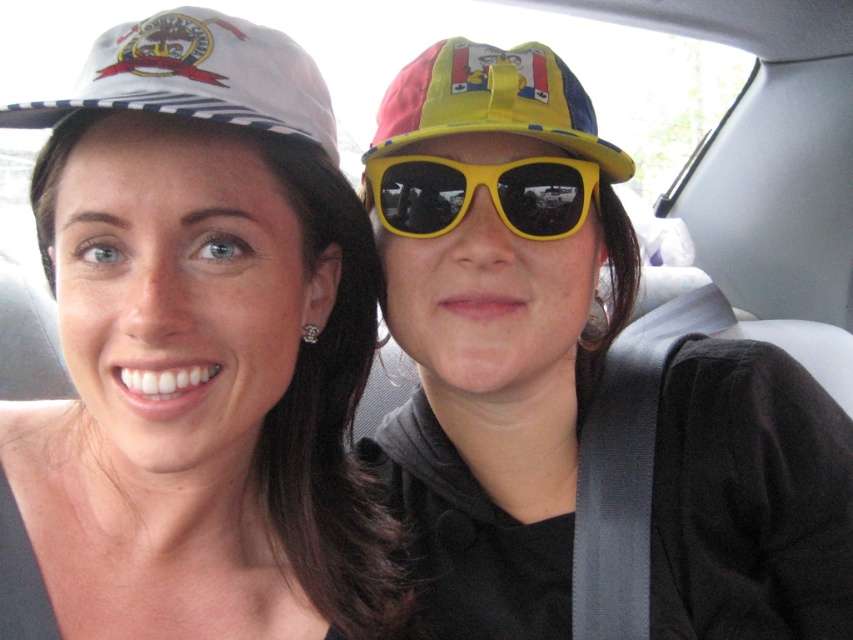
Consider the image. Is white glossy hat at upper left shorter than yellow matte sunglasses at upper center?

Yes, white glossy hat at upper left is shorter than yellow matte sunglasses at upper center.

Does point (316, 172) come closer to viewer compared to point (457, 525)?

Yes, point (316, 172) is closer to viewer.

Which is in front, point (165, 115) or point (564, 538)?

Point (165, 115)

Locate an element on the screen. This screenshot has width=853, height=640. white glossy hat at upper left is located at coordinates (196, 353).

Is white printed baseball cap at upper left positioned before yellow plastic sunglasses at center?

That is True.

Is white printed baseball cap at upper left taller than yellow plastic sunglasses at center?

Indeed, white printed baseball cap at upper left has a greater height compared to yellow plastic sunglasses at center.

Describe the element at coordinates (196, 76) in the screenshot. This screenshot has width=853, height=640. I see `white printed baseball cap at upper left` at that location.

Find the location of a particular element. The image size is (853, 640). white printed baseball cap at upper left is located at coordinates click(196, 76).

Is yellow matte sunglasses at upper center wider than yellow fabric cap at upper center?

Yes, yellow matte sunglasses at upper center is wider than yellow fabric cap at upper center.

Who is positioned more to the left, yellow matte sunglasses at upper center or yellow fabric cap at upper center?

yellow fabric cap at upper center

I want to click on yellow matte sunglasses at upper center, so click(x=492, y=324).